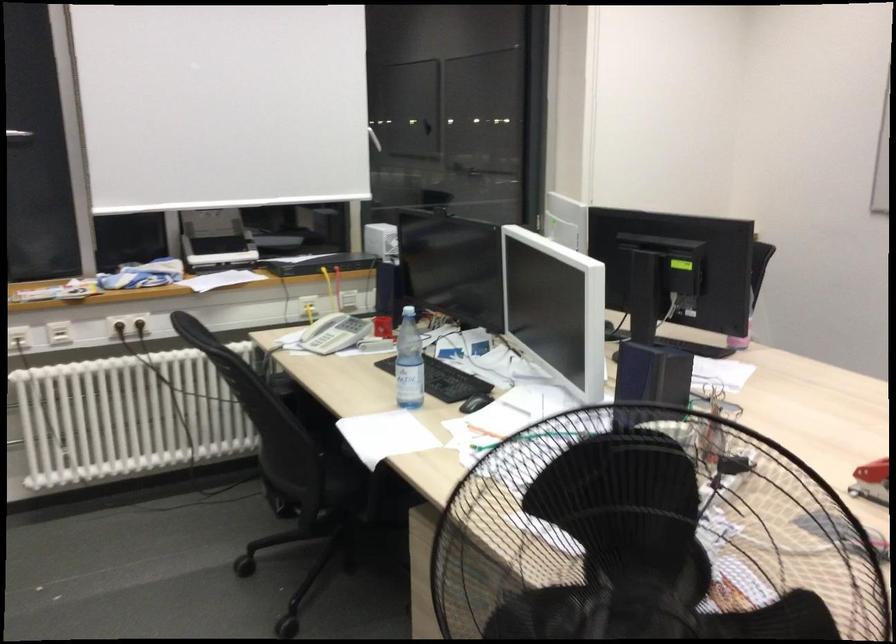
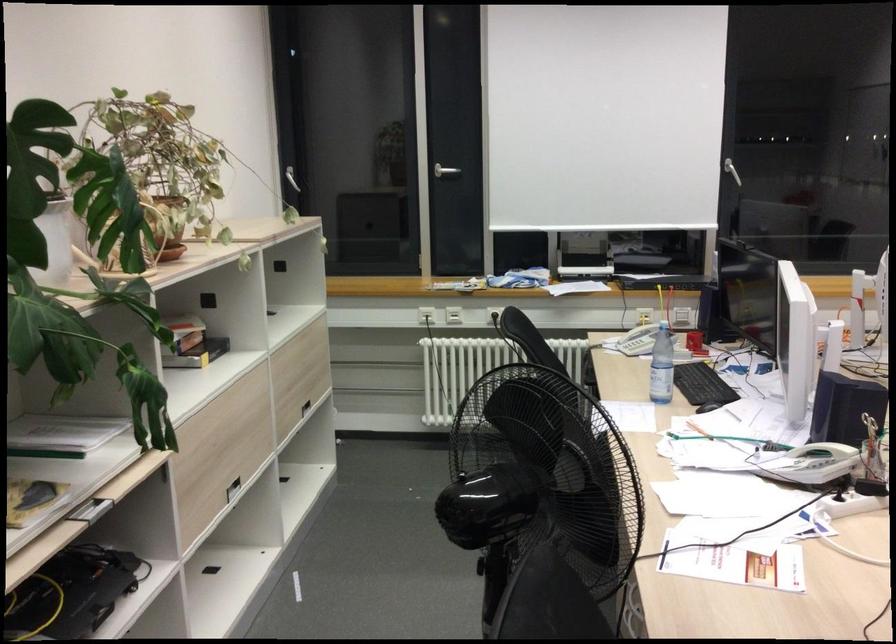
Locate, in the second image, the point that corresponds to the point at 402,361 in the first image.

(661, 366)